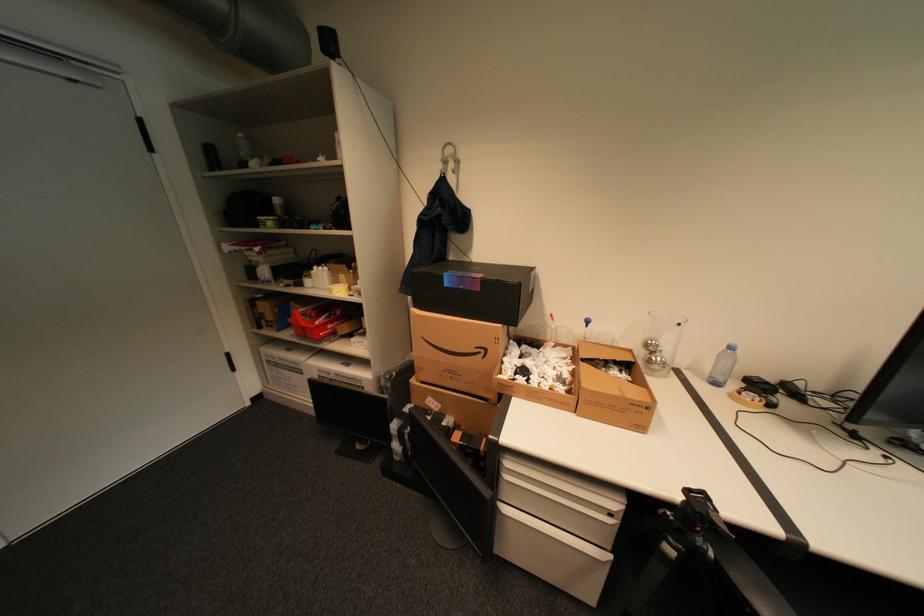
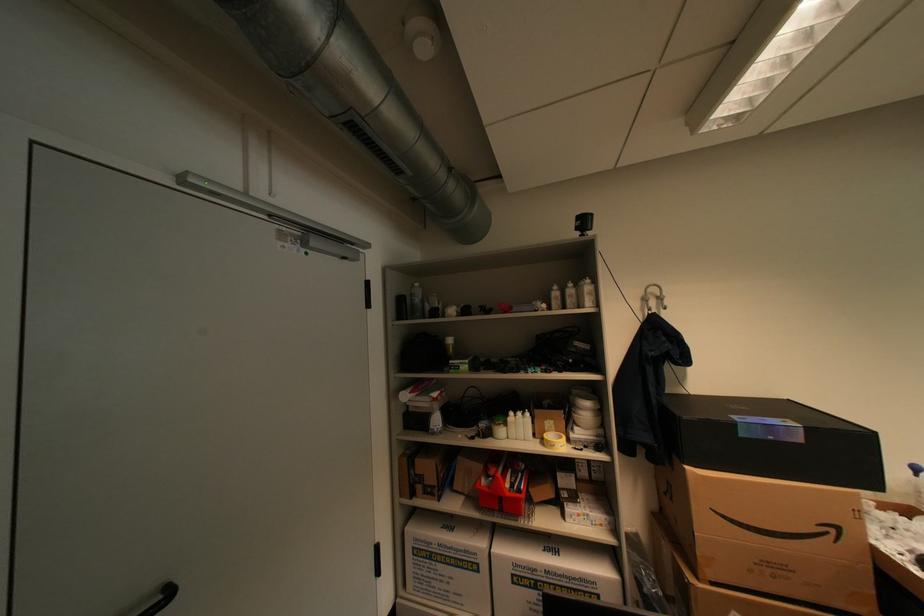
Locate, in the second image, the point that corresponds to pixel 311 325 in the first image.

(516, 495)